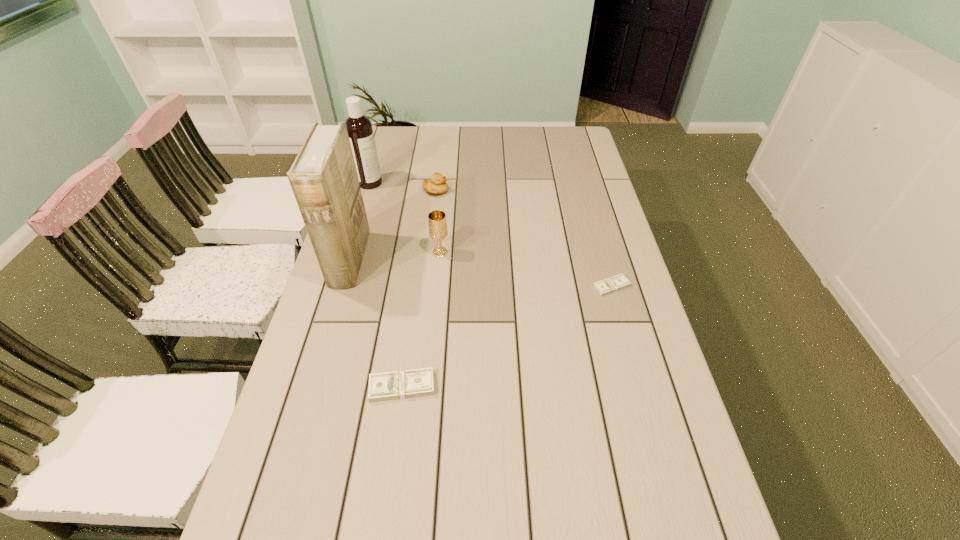
Identify which object is the third nearest to the shorter money. Please provide its 2D coordinates. Your answer should be formatted as a tuple, i.e. [(x, y)], where the tuple contains the x and y coordinates of a point satisfying the conditions above.

[(437, 185)]

Find the location of a particular element. The image size is (960, 540). free spot that satisfies the following two spatial constraints: 1. on the front-facing side of the third shortest object; 2. on the back side of the fourth shortest object is located at coordinates (428, 253).

Find the location of `vacant position in the image that satisfies the following two spatial constraints: 1. on the back side of the right money; 2. on the front-facing side of the third shortest object`. vacant position in the image that satisfies the following two spatial constraints: 1. on the back side of the right money; 2. on the front-facing side of the third shortest object is located at coordinates [585, 191].

At what (x,y) coordinates should I click in order to perform the action: click on vacant region that satisfies the following two spatial constraints: 1. on the label side of the dishwasher detergent; 2. on the back side of the right money. Please return your answer as a coordinate pair (x, y). This screenshot has width=960, height=540. Looking at the image, I should click on (339, 286).

You are a GUI agent. You are given a task and a screenshot of the screen. Output one action in this format:
    pyautogui.click(x=<x>, y=<y>)
    Task: Click on the free space in the image that satisfies the following two spatial constraints: 1. on the back side of the right money; 2. on the label side of the dishwasher detergent
    Image resolution: width=960 pixels, height=540 pixels.
    Given the screenshot: What is the action you would take?
    click(x=583, y=183)